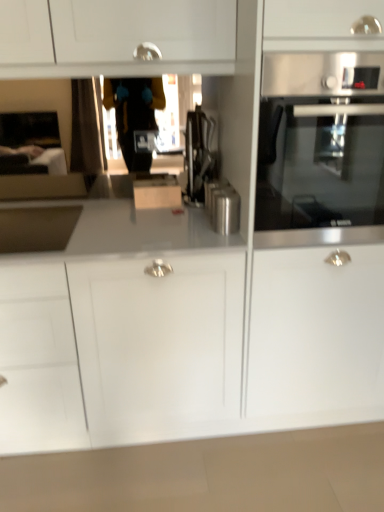
Question: From a real-world perspective, is satin black coffee machine at center above or below satin nickel sink at left?

Choices:
 (A) above
 (B) below

Answer: (A)

Question: Visually, is satin black coffee machine at center positioned to the left or to the right of satin nickel sink at left?

Choices:
 (A) left
 (B) right

Answer: (B)

Question: Which is farther from the satin metallic canister at center?

Choices:
 (A) satin black coffee machine at center
 (B) satin nickel sink at left
 (C) stainless steel oven at right
 (D) white glossy countertop at lower center

Answer: (D)

Question: Which object is positioned closest to the satin nickel sink at left?

Choices:
 (A) satin metallic canister at center
 (B) white glossy countertop at lower center
 (C) satin black coffee machine at center
 (D) stainless steel oven at right

Answer: (C)